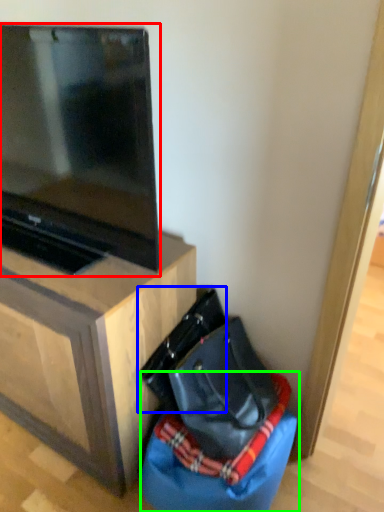
Question: Based on their relative distances, which object is nearer to television (highlighted by a red box)? Choose from messenger bag (highlighted by a blue box) and bean bag chair (highlighted by a green box).

Choices:
 (A) messenger bag
 (B) bean bag chair

Answer: (A)